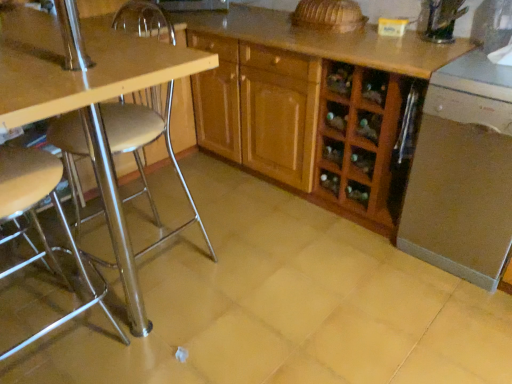
The image size is (512, 384). Identify the location of metallic silver stool at left. (40, 225).

Image resolution: width=512 pixels, height=384 pixels. What are the coordinates of `swivel chair above the wooden table at left (from a real-world perspective)` in the screenshot? It's located at (140, 129).

How much distance is there between metallic silver stool at left and wooden table at left?

metallic silver stool at left is 12.27 inches from wooden table at left.

Would you say metallic silver stool at left is to the left or to the right of wooden table at left in the picture?

Based on their positions, metallic silver stool at left is located to the right of wooden table at left.

Which is farther, (136,30) or (115,81)?

The point (136,30) is behind.

Between metallic silver stool at left and satin silver dishwasher at lower right, which one has larger width?

satin silver dishwasher at lower right is wider.

Is metallic silver stool at left oriented towards satin silver dishwasher at lower right?

No, metallic silver stool at left is not facing towards satin silver dishwasher at lower right.

Is metallic silver stool at left situated inside satin silver dishwasher at lower right or outside?

metallic silver stool at left is outside satin silver dishwasher at lower right.

Considering the positions of points (474, 62) and (21, 151), is point (474, 62) closer to camera compared to point (21, 151)?

No, it is not.

Is satin silver dishwasher at lower right at the left side of metallic silver stool at left?

No, satin silver dishwasher at lower right is not to the left of metallic silver stool at left.

Is satin silver dishwasher at lower right facing towards metallic silver stool at left?

No, satin silver dishwasher at lower right is not aimed at metallic silver stool at left.

Are satin silver dishwasher at lower right and metallic silver stool at left making contact?

satin silver dishwasher at lower right and metallic silver stool at left are not in contact.

Is metallic silver stool at left far away from wooden cabinet at center?

That's right, there is a large distance between metallic silver stool at left and wooden cabinet at center.

From a real-world perspective, is metallic silver stool at left physically above wooden cabinet at center?

Yes, from a real-world perspective, metallic silver stool at left is above wooden cabinet at center.

Based on their positions, is metallic silver stool at left located to the left or right of wooden cabinet at center?

Based on their positions, metallic silver stool at left is located to the left of wooden cabinet at center.

Consider the image. Is wooden cabinet at center at the back of metallic silver stool at left?

No, wooden cabinet at center is not at the back of metallic silver stool at left.

Are satin silver dishwasher at lower right and wooden cabinet at center located far from each other?

No.

Identify the location of dish washer located underneath the wooden cabinet at center (from a real-world perspective). (463, 173).

Considering the relative sizes of satin silver dishwasher at lower right and wooden cabinet at center in the image provided, is satin silver dishwasher at lower right taller than wooden cabinet at center?

No, satin silver dishwasher at lower right is not taller than wooden cabinet at center.

Would you say satin silver dishwasher at lower right is to the left or to the right of wooden cabinet at center in the picture?

In the image, satin silver dishwasher at lower right appears on the right side of wooden cabinet at center.

Looking at their sizes, would you say metallic silver stool at left is wider or thinner than metallic silver stool at left?

Clearly, metallic silver stool at left has more width compared to metallic silver stool at left.

What's the angular difference between metallic silver stool at left and metallic silver stool at left's facing directions?

91 degrees separate the facing orientations of metallic silver stool at left and metallic silver stool at left.

Is metallic silver stool at left positioned with its back to metallic silver stool at left?

No, metallic silver stool at left is not facing the opposite direction of metallic silver stool at left.

Between metallic silver stool at left and metallic silver stool at left, which one is positioned in front?

metallic silver stool at left is more forward.

Looking at this image, which is in front, metallic silver stool at left or wooden cabinet at center?

Positioned in front is metallic silver stool at left.

Which is closer to the camera, (137, 254) or (356, 112)?

Point (137, 254) appears to be farther away from the viewer than point (356, 112).

Is metallic silver stool at left thinner than wooden cabinet at center?

Yes, metallic silver stool at left is thinner than wooden cabinet at center.

From their relative heights in the image, would you say metallic silver stool at left is taller or shorter than wooden cabinet at center?

In the image, metallic silver stool at left appears to be taller than wooden cabinet at center.

What are the coordinates of `swivel chair in front of the wooden table at left` in the screenshot? It's located at (140, 129).

Identify the location of dish washer located underneath the metallic silver stool at left (from a real-world perspective). (463, 173).

From the image, which object appears to be nearer to metallic silver stool at left, wooden cabinet at center or satin silver dishwasher at lower right?

wooden cabinet at center.

Based on their spatial positions, is satin silver dishwasher at lower right or wooden cabinet at center closer to wooden table at left?

Based on the image, wooden cabinet at center appears to be nearer to wooden table at left.

From the image, which object appears to be farther from metallic silver stool at left, satin silver dishwasher at lower right or metallic silver stool at left?

satin silver dishwasher at lower right lies further to metallic silver stool at left than the other object.

When comparing their distances from metallic silver stool at left, does satin silver dishwasher at lower right or wooden cabinet at center seem closer?

wooden cabinet at center lies closer to metallic silver stool at left than the other object.

Considering their positions, is metallic silver stool at left positioned closer to satin silver dishwasher at lower right than wooden cabinet at center?

A: wooden cabinet at center.

From the image, which object appears to be nearer to wooden cabinet at center, wooden table at left or metallic silver stool at left?

Among the two, metallic silver stool at left is located nearer to wooden cabinet at center.

When comparing their distances from metallic silver stool at left, does wooden cabinet at center or wooden table at left seem further?

The object further to metallic silver stool at left is wooden cabinet at center.

Considering their positions, is wooden cabinet at center positioned further to satin silver dishwasher at lower right than metallic silver stool at left?

metallic silver stool at left is further to satin silver dishwasher at lower right.

Identify the location of table situated between metallic silver stool at left and wooden cabinet at center from left to right. (87, 100).

The height and width of the screenshot is (384, 512). I want to click on table between metallic silver stool at left and satin silver dishwasher at lower right in the horizontal direction, so click(x=87, y=100).

The height and width of the screenshot is (384, 512). Identify the location of swivel chair located between wooden table at left and wooden cabinet at center in the left-right direction. (140, 129).

The height and width of the screenshot is (384, 512). I want to click on swivel chair located between metallic silver stool at left and wooden cabinet at center in the left-right direction, so click(x=140, y=129).